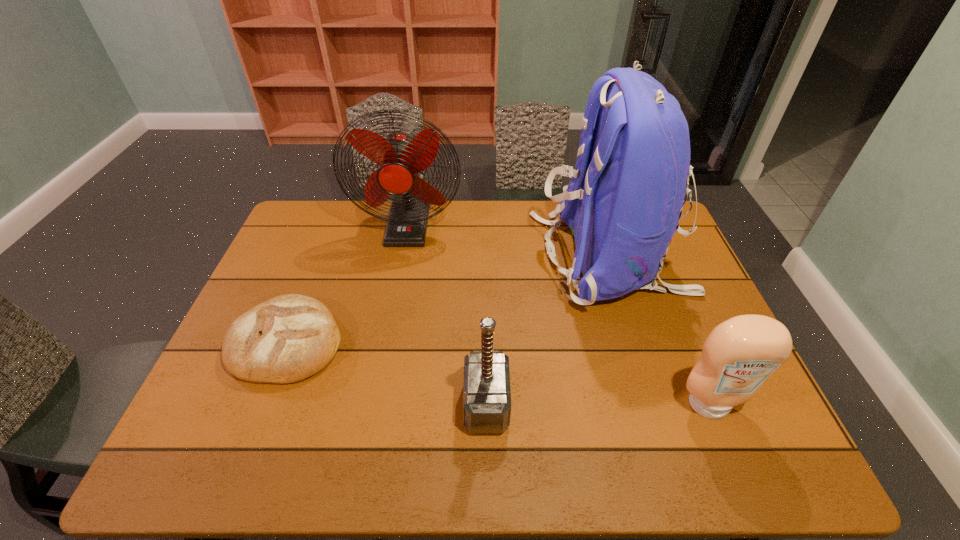
The image size is (960, 540). I want to click on free space at the near edge of the desktop, so click(x=466, y=438).

In the image, there is a desktop. Identify the location of free region at the left edge. click(x=320, y=265).

Where is `vacant space at the right edge of the desktop`? vacant space at the right edge of the desktop is located at coordinates (692, 269).

This screenshot has height=540, width=960. Find the location of `free space at the far left corner of the desktop`. free space at the far left corner of the desktop is located at coordinates (325, 206).

Image resolution: width=960 pixels, height=540 pixels. I want to click on free area in between the fan and the shortest object, so click(x=348, y=284).

Locate an element on the screen. The width and height of the screenshot is (960, 540). free space between the second tallest object and the backpack is located at coordinates click(509, 241).

This screenshot has width=960, height=540. Identify the location of free space between the bread and the tallest object. (448, 300).

Image resolution: width=960 pixels, height=540 pixels. In order to click on empty location between the fan and the condiment in this screenshot , I will do `click(559, 315)`.

Locate an element on the screen. This screenshot has width=960, height=540. empty space that is in between the shortest object and the fan is located at coordinates (348, 284).

Find the location of a particular element. Image resolution: width=960 pixels, height=540 pixels. free space between the hammer and the fan is located at coordinates (447, 315).